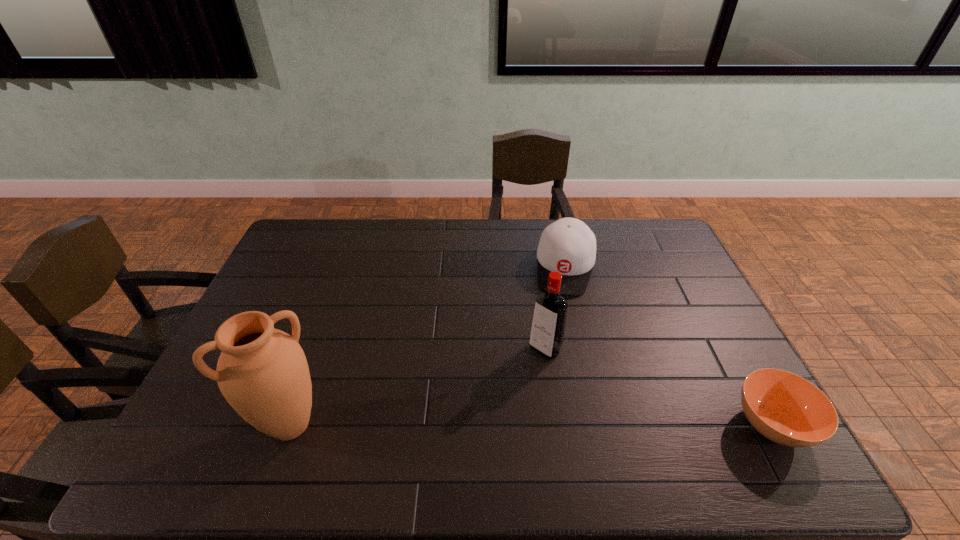
The image size is (960, 540). In order to click on urn in this screenshot , I will do `click(262, 372)`.

Identify the location of the leftmost object. (262, 372).

The image size is (960, 540). Identify the location of the rightmost object. (785, 408).

Where is `soup bowl`? The height and width of the screenshot is (540, 960). soup bowl is located at coordinates (785, 408).

You are a GUI agent. You are given a task and a screenshot of the screen. Output one action in this format:
    pyautogui.click(x=<x>, y=<y>)
    Task: Click on the second farthest object
    
    Given the screenshot: What is the action you would take?
    pyautogui.click(x=548, y=325)

Image resolution: width=960 pixels, height=540 pixels. What are the coordinates of `the third shortest object` in the screenshot? It's located at (548, 325).

I want to click on baseball cap, so click(568, 246).

The width and height of the screenshot is (960, 540). In order to click on the second shortest object in this screenshot , I will do `click(568, 246)`.

Find the location of a particular element. free point located 0.060m on the back of the tallest object is located at coordinates (308, 376).

The height and width of the screenshot is (540, 960). I want to click on vacant area situated 0.390m on the back of the soup bowl, so click(698, 289).